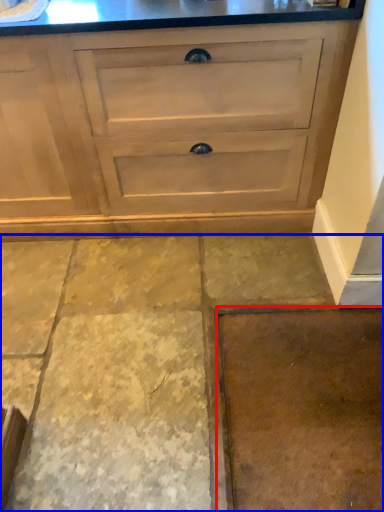
Question: Which object is closer to the camera taking this photo, concrete (highlighted by a red box) or concrete (highlighted by a blue box)?

Choices:
 (A) concrete
 (B) concrete

Answer: (B)